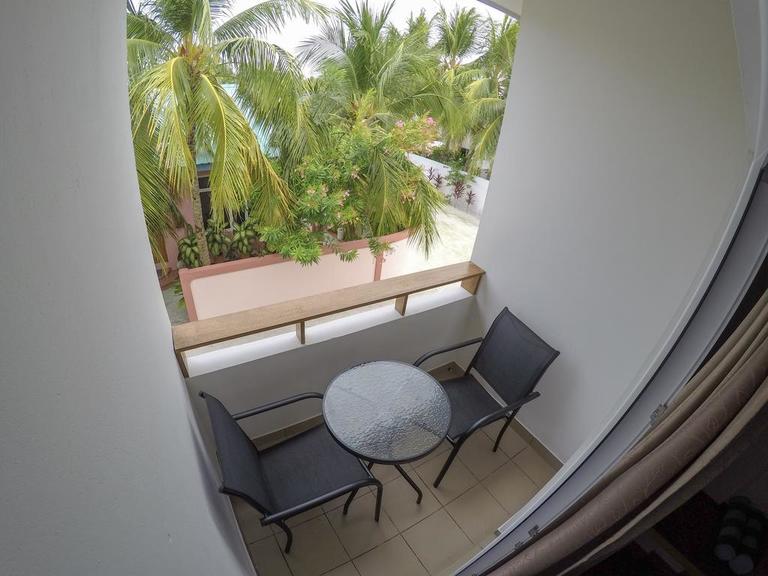
Locate an element on the screen. white wall is located at coordinates (475, 193), (425, 165).